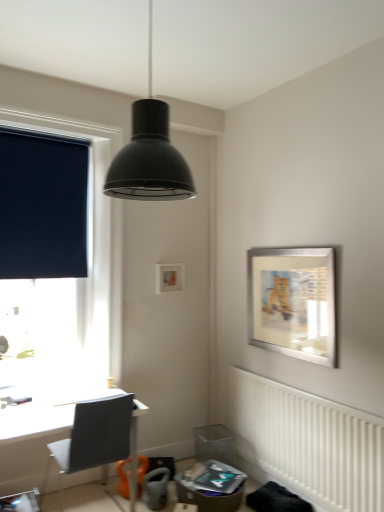
What is the approximate width of dark blue roller blind at left?

It is 9.96 inches.

Describe the element at coordinates (43, 206) in the screenshot. I see `dark blue fabric at left` at that location.

Describe the element at coordinates (97, 439) in the screenshot. I see `gray fabric chair at lower left` at that location.

Image resolution: width=384 pixels, height=512 pixels. Describe the element at coordinates (293, 302) in the screenshot. I see `silver metallic picture frame at upper right` at that location.

The image size is (384, 512). What are the coordinates of `white textured radiator at lower right` in the screenshot? It's located at (308, 443).

The height and width of the screenshot is (512, 384). Identify the location of dark blue roller blind at left. (53, 260).

Can you confirm if dark blue roller blind at left is positioned to the right of gray fabric chair at lower left?

No, dark blue roller blind at left is not to the right of gray fabric chair at lower left.

From a real-world perspective, who is located lower, dark blue roller blind at left or gray fabric chair at lower left?

gray fabric chair at lower left.

Considering the points (76, 153) and (136, 454), which point is behind, point (76, 153) or point (136, 454)?

Positioned behind is point (136, 454).

From the image's perspective, between dark blue roller blind at left and gray fabric chair at lower left, which one is located above?

From the image's view, dark blue roller blind at left is above.

How many degrees apart are the facing directions of white textured radiator at lower right and gray fabric chair at lower left?

white textured radiator at lower right and gray fabric chair at lower left are facing 87 degrees away from each other.

From the image's perspective, would you say white textured radiator at lower right is positioned over gray fabric chair at lower left?

No, from the image's perspective, white textured radiator at lower right is not over gray fabric chair at lower left.

Does point (354, 460) lie in front of point (89, 426)?

No, (354, 460) is behind (89, 426).

Considering the sizes of gray fabric chair at lower left and dark blue roller blind at left in the image, is gray fabric chair at lower left bigger or smaller than dark blue roller blind at left?

gray fabric chair at lower left is smaller than dark blue roller blind at left.

From a real-world perspective, is gray fabric chair at lower left under dark blue roller blind at left?

Yes, from a real-world perspective, gray fabric chair at lower left is below dark blue roller blind at left.

Image resolution: width=384 pixels, height=512 pixels. I want to click on chair lying below the dark blue roller blind at left (from the image's perspective), so click(x=97, y=439).

Can you tell me how much gray fabric chair at lower left and dark blue roller blind at left differ in facing direction?

The angular difference between gray fabric chair at lower left and dark blue roller blind at left is 176 degrees.

Would you consider silver metallic picture frame at upper right to be distant from dark blue roller blind at left?

Absolutely, silver metallic picture frame at upper right is distant from dark blue roller blind at left.

Considering the relative sizes of silver metallic picture frame at upper right and dark blue roller blind at left in the image provided, is silver metallic picture frame at upper right smaller than dark blue roller blind at left?

Correct, silver metallic picture frame at upper right occupies less space than dark blue roller blind at left.

From a real-world perspective, between silver metallic picture frame at upper right and dark blue roller blind at left, who is vertically lower?

From a 3D spatial view, silver metallic picture frame at upper right is below.

Considering the sizes of objects silver metallic picture frame at upper right and dark blue roller blind at left in the image provided, who is thinner, silver metallic picture frame at upper right or dark blue roller blind at left?

With smaller width is silver metallic picture frame at upper right.

From the image's perspective, is matte black pendant light at upper center under gray fabric chair at lower left?

No, from the image's perspective, matte black pendant light at upper center is not beneath gray fabric chair at lower left.

Who is shorter, matte black pendant light at upper center or gray fabric chair at lower left?

Standing shorter between the two is matte black pendant light at upper center.

Considering the positions of point (137, 106) and point (120, 418), is point (137, 106) closer or farther from the camera than point (120, 418)?

Point (137, 106) is closer to the camera than point (120, 418).

From the image's perspective, is white textured radiator at lower right below dark blue fabric at left?

Yes.

Can dark blue fabric at left be found inside white textured radiator at lower right?

No.

Does white textured radiator at lower right have a smaller size compared to dark blue fabric at left?

No.

What's the angular difference between white textured radiator at lower right and dark blue fabric at left's facing directions?

There is a 89.1-degree angle between the facing directions of white textured radiator at lower right and dark blue fabric at left.

Is matte black pendant light at upper center oriented towards silver metallic picture frame at upper right?

No, matte black pendant light at upper center is not turned towards silver metallic picture frame at upper right.

You are a GUI agent. You are given a task and a screenshot of the screen. Output one action in this format:
    pyautogui.click(x=<x>, y=<y>)
    Task: Click on the lamp in front of the silver metallic picture frame at upper right
    
    Given the screenshot: What is the action you would take?
    pyautogui.click(x=149, y=154)

Is point (183, 160) farther from camera compared to point (253, 279)?

No, (183, 160) is in front of (253, 279).

Between matte black pendant light at upper center and silver metallic picture frame at upper right, which one appears on the right side from the viewer's perspective?

silver metallic picture frame at upper right is more to the right.

Find the location of a particular element. The height and width of the screenshot is (512, 384). window above the gray fabric chair at lower left (from the image's perspective) is located at coordinates (53, 260).

At what (x,y) coordinates should I click in order to perform the action: click on chair located behind the white textured radiator at lower right. Please return your answer as a coordinate pair (x, y). The image size is (384, 512). Looking at the image, I should click on (97, 439).

Estimate the real-world distances between objects in this image. Which object is closer to dark blue roller blind at left, silver metallic picture frame at upper right or gray fabric chair at lower left?

Among the two, gray fabric chair at lower left is located nearer to dark blue roller blind at left.

Considering their positions, is dark blue fabric at left positioned further to dark blue roller blind at left than matte black pendant light at upper center?

The object further to dark blue roller blind at left is matte black pendant light at upper center.

Which object lies further to the anchor point silver metallic picture frame at upper right, dark blue fabric at left or matte black pendant light at upper center?

matte black pendant light at upper center is further to silver metallic picture frame at upper right.

Which object lies further to the anchor point matte black pendant light at upper center, dark blue roller blind at left or white textured radiator at lower right?

white textured radiator at lower right is further to matte black pendant light at upper center.

When comparing their distances from matte black pendant light at upper center, does silver metallic picture frame at upper right or gray fabric chair at lower left seem closer?

Among the two, gray fabric chair at lower left is located nearer to matte black pendant light at upper center.

From the image, which object appears to be farther from dark blue fabric at left, silver metallic picture frame at upper right or white textured radiator at lower right?

white textured radiator at lower right is positioned further to the anchor dark blue fabric at left.

Estimate the real-world distances between objects in this image. Which object is further from silver metallic picture frame at upper right, dark blue roller blind at left or dark blue fabric at left?

dark blue fabric at left is positioned further to the anchor silver metallic picture frame at upper right.

Looking at the image, which one is located further to matte black pendant light at upper center, dark blue roller blind at left or silver metallic picture frame at upper right?

Based on the image, dark blue roller blind at left appears to be further to matte black pendant light at upper center.

Find the location of a particular element. window between dark blue fabric at left and silver metallic picture frame at upper right is located at coordinates (53, 260).

Where is `window between dark blue fabric at left and white textured radiator at lower right from left to right`? The width and height of the screenshot is (384, 512). window between dark blue fabric at left and white textured radiator at lower right from left to right is located at coordinates [53, 260].

Identify the location of radiator situated between gray fabric chair at lower left and silver metallic picture frame at upper right from left to right. This screenshot has height=512, width=384. (308, 443).

This screenshot has width=384, height=512. What are the coordinates of `chair between dark blue roller blind at left and silver metallic picture frame at upper right` in the screenshot? It's located at (97, 439).